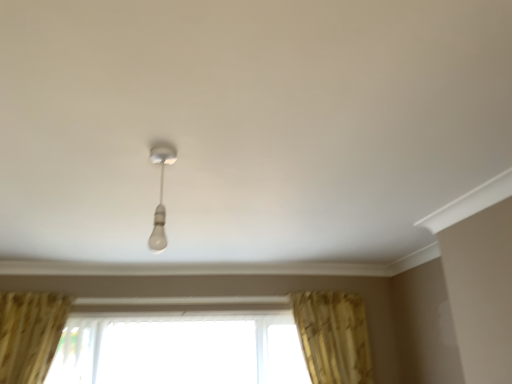
Question: From a real-world perspective, is white glossy bulb at center positioned over gold textured curtain at lower right based on gravity?

Choices:
 (A) no
 (B) yes

Answer: (B)

Question: From the image's perspective, is white glossy bulb at center under gold textured curtain at lower right?

Choices:
 (A) no
 (B) yes

Answer: (A)

Question: Could gold textured curtain at lower right be considered to be inside white glossy bulb at center?

Choices:
 (A) yes
 (B) no

Answer: (B)

Question: Considering the relative sizes of white glossy bulb at center and gold textured curtain at lower right in the image provided, is white glossy bulb at center taller than gold textured curtain at lower right?

Choices:
 (A) no
 (B) yes

Answer: (A)

Question: Is there a large distance between white glossy bulb at center and gold textured curtain at lower right?

Choices:
 (A) no
 (B) yes

Answer: (B)

Question: Does point (111, 374) appear closer or farther from the camera than point (164, 246)?

Choices:
 (A) farther
 (B) closer

Answer: (A)

Question: From the image's perspective, is transparent glass window at center above or below white glossy bulb at center?

Choices:
 (A) below
 (B) above

Answer: (A)

Question: Looking at their shapes, would you say transparent glass window at center is wider or thinner than white glossy bulb at center?

Choices:
 (A) wide
 (B) thin

Answer: (A)

Question: In the image, is transparent glass window at center on the left side or the right side of white glossy bulb at center?

Choices:
 (A) right
 (B) left

Answer: (B)

Question: Relative to gold textured curtain at lower right, is white glossy bulb at center in front or behind?

Choices:
 (A) front
 (B) behind

Answer: (A)

Question: Considering the positions of point (160, 236) and point (354, 314), is point (160, 236) closer or farther from the camera than point (354, 314)?

Choices:
 (A) closer
 (B) farther

Answer: (A)

Question: Considering the positions of white glossy bulb at center and gold textured curtain at lower right in the image, is white glossy bulb at center taller or shorter than gold textured curtain at lower right?

Choices:
 (A) short
 (B) tall

Answer: (A)

Question: Do you think white glossy bulb at center is within gold textured curtain at lower right, or outside of it?

Choices:
 (A) outside
 (B) inside

Answer: (A)

Question: From their relative heights in the image, would you say gold textured curtain at lower right is taller or shorter than transparent glass window at center?

Choices:
 (A) short
 (B) tall

Answer: (B)

Question: From the image's perspective, is gold textured curtain at lower right positioned above or below transparent glass window at center?

Choices:
 (A) below
 (B) above

Answer: (B)